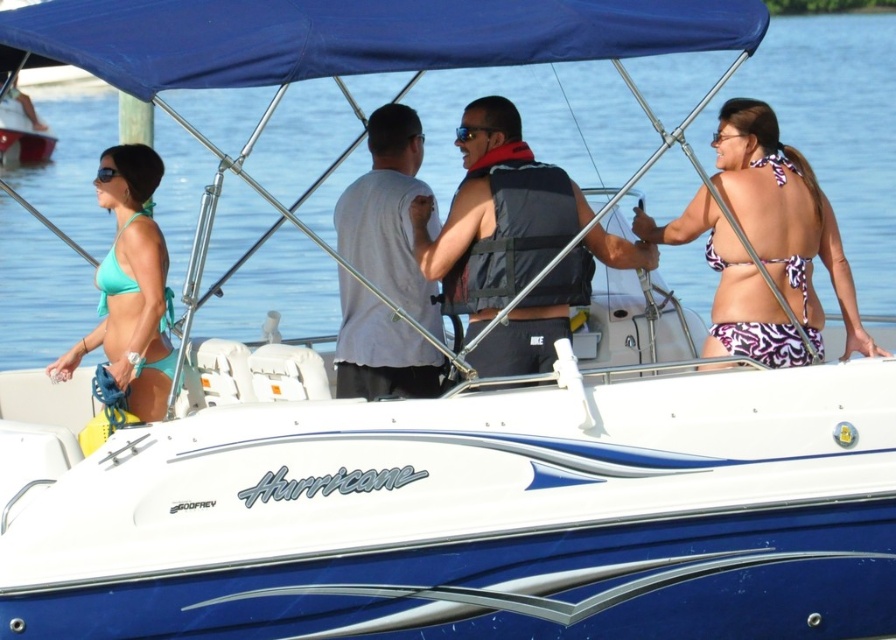
You are a photographer on the shore taking pictures of the boat named Hurricane. You notice two items on the boat that need to be in focus for your shot. The items are the dark gray life vest at center and the purple printed bikini top at right. Based on their positions, which item is closer to the left edge of your camera frame?

The dark gray life vest at center is positioned on the left side of the purple printed bikini top at right, so it is closer to the left edge of the camera frame.

You are on the boat named Hurricane and want to find the purple printed bikini top at right. According to the coordinates given, where should you look?

The purple printed bikini top at right is located at coordinates point [784,218].